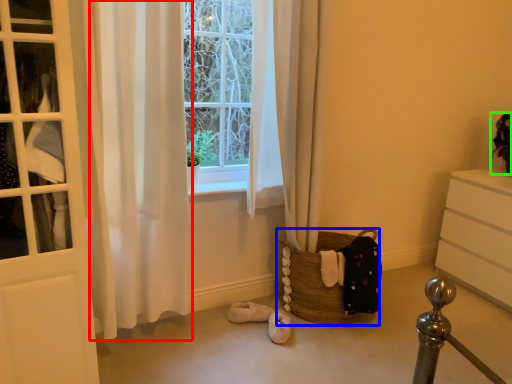
Question: Based on their relative distances, which object is farther from curtain (highlighted by a red box)? Choose from basket (highlighted by a blue box) and doll (highlighted by a green box).

Choices:
 (A) basket
 (B) doll

Answer: (B)